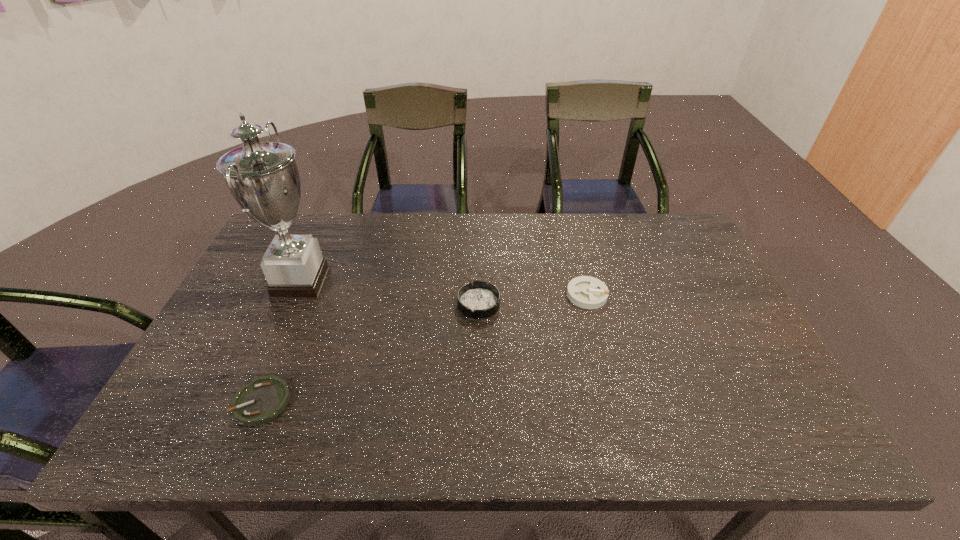
You are a GUI agent. You are given a task and a screenshot of the screen. Output one action in this format:
    pyautogui.click(x=<x>, y=<y>)
    Task: Click on the vacant region that satisfies the following two spatial constraints: 1. at the front view of the second ashtray from left to right; 2. on the left side of the trophy cup
    This screenshot has height=540, width=960.
    Given the screenshot: What is the action you would take?
    pyautogui.click(x=291, y=303)

Where is `vacant region that satisfies the following two spatial constraints: 1. at the front view of the tallest object; 2. on the back side of the second ashtray from left to right`? The height and width of the screenshot is (540, 960). vacant region that satisfies the following two spatial constraints: 1. at the front view of the tallest object; 2. on the back side of the second ashtray from left to right is located at coordinates (291, 303).

Identify the location of vacant space that satisfies the following two spatial constraints: 1. at the front view of the tallest object; 2. on the right side of the rightmost ashtray. Image resolution: width=960 pixels, height=540 pixels. (295, 295).

Identify the location of free location that satisfies the following two spatial constraints: 1. at the front view of the shortest ashtray; 2. on the left side of the tallest object. (247, 402).

I want to click on free space in the image that satisfies the following two spatial constraints: 1. at the front view of the tallest object; 2. on the left side of the rightmost object, so click(x=295, y=295).